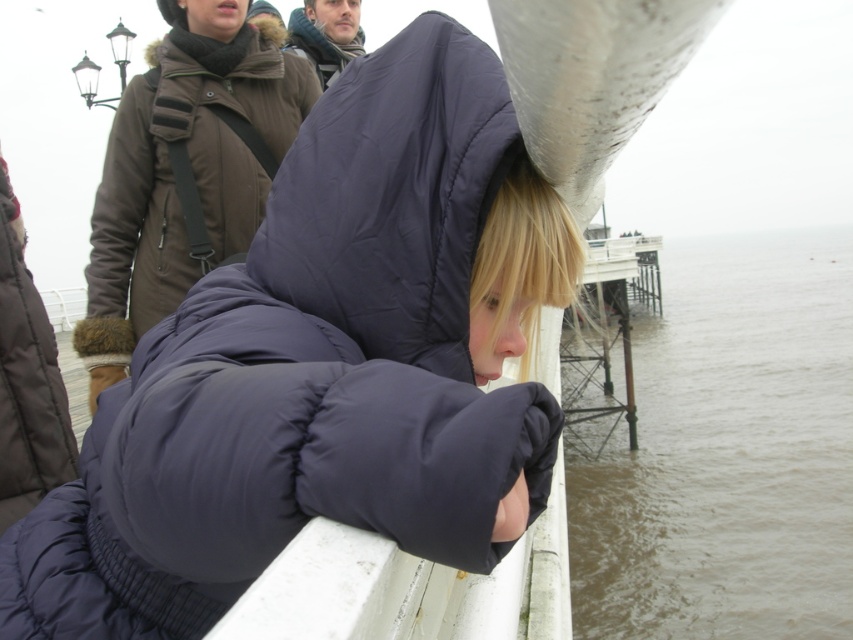
Question: Which point is closer to the camera?

Choices:
 (A) (329, 44)
 (B) (791, 422)
 (C) (490, 68)
 (D) (189, 29)

Answer: (C)

Question: Can you confirm if navy blue puffer jacket at center is wider than brown murky water at lower right?

Choices:
 (A) yes
 (B) no

Answer: (B)

Question: Considering the relative positions of brown murky water at lower right and dark brown woolen coat at upper center in the image provided, where is brown murky water at lower right located with respect to dark brown woolen coat at upper center?

Choices:
 (A) left
 (B) right

Answer: (B)

Question: Which object is farther from the camera taking this photo?

Choices:
 (A) dark brown puffy coat at upper center
 (B) dark brown woolen coat at upper center
 (C) navy blue puffer jacket at center
 (D) brown murky water at lower right

Answer: (D)

Question: Which object is the closest to the brown murky water at lower right?

Choices:
 (A) dark brown puffy coat at upper center
 (B) dark brown woolen coat at upper center
 (C) navy blue puffer jacket at center

Answer: (A)

Question: Is navy blue puffer jacket at center above dark brown woolen coat at upper center?

Choices:
 (A) yes
 (B) no

Answer: (B)